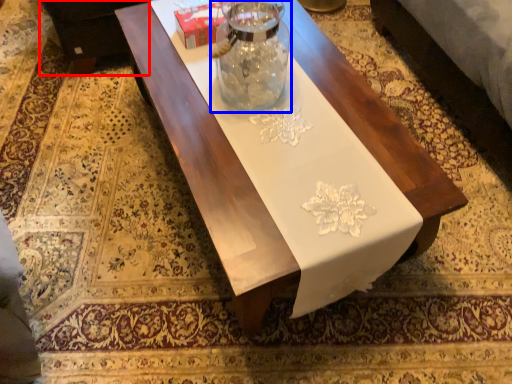
Question: Among these objects, which one is nearest to the camera, couch (highlighted by a red box) or glass vase (highlighted by a blue box)?

Choices:
 (A) couch
 (B) glass vase

Answer: (B)